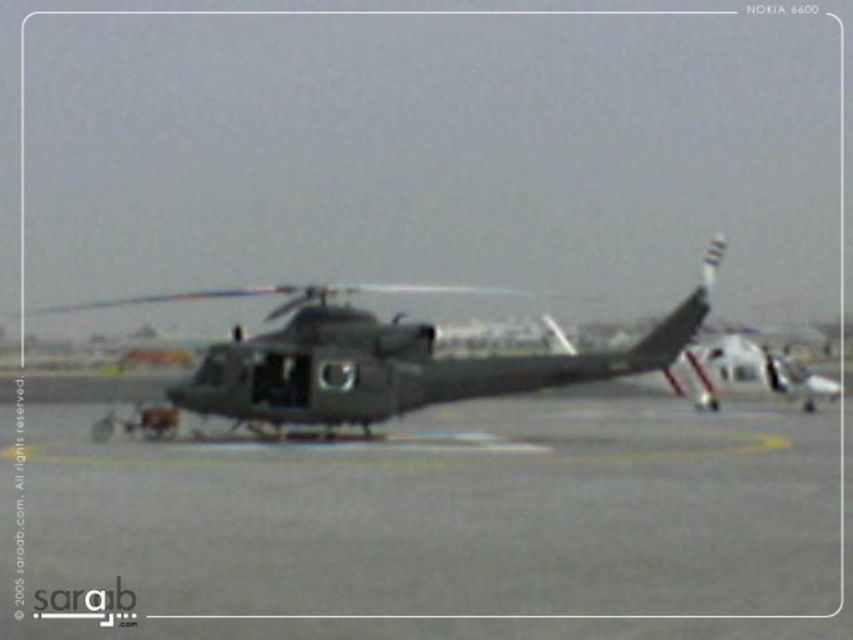
You are a pilot who needs to determine if there is enough space to land your helicopter on the gray asphalt tarmac at center. Given that your helicopter is the same size as the dark gray matte helicopter at center, can you land safely?

The gray asphalt tarmac at center has a smaller size compared to dark gray matte helicopter at center. Since your helicopter is the same size as the dark gray matte helicopter at center, the tarmac is too small to accommodate it safely. Choose a larger landing area instead.

You are a pilot preparing to land your helicopter on the gray asphalt tarmac at center. You notice the dark gray matte helicopter at center is already parked there. Based on their positions, can you safely land your helicopter on the tarmac without overlapping the parked helicopter?

The gray asphalt tarmac at center is positioned on the right side of the dark gray matte helicopter at center. Since the tarmac is to the right of the parked helicopter, there should be enough space to land safely as long as you position your helicopter on the tarmac area away from the parked helicopter.